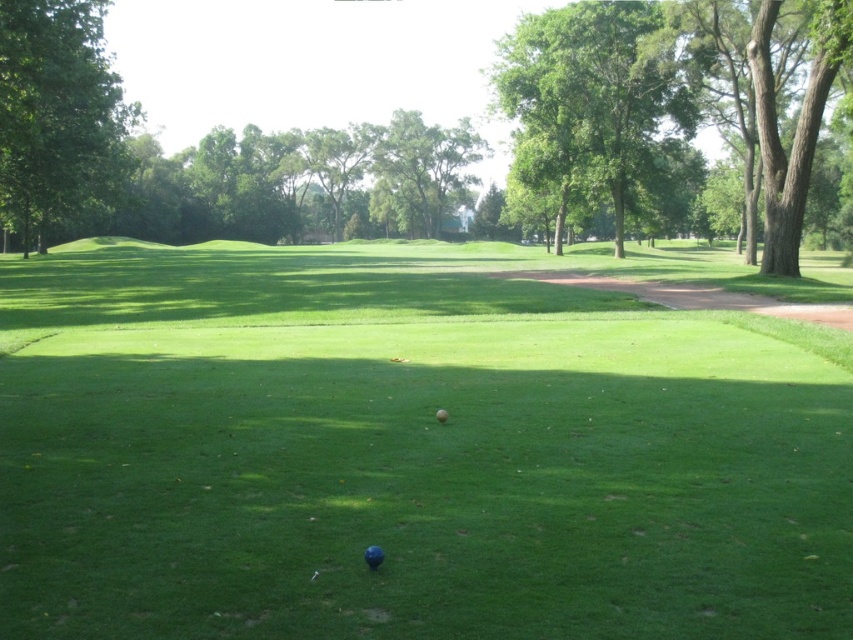
Does green grass at center appear under blue rubber golf ball at center?

Incorrect, green grass at center is not positioned below blue rubber golf ball at center.

You are a GUI agent. You are given a task and a screenshot of the screen. Output one action in this format:
    pyautogui.click(x=<x>, y=<y>)
    Task: Click on the green grass at center
    Image resolution: width=853 pixels, height=640 pixels.
    Given the screenshot: What is the action you would take?
    pyautogui.click(x=415, y=445)

Can you confirm if green leafy tree at upper center is positioned below blue rubber golf ball at center?

Actually, green leafy tree at upper center is above blue rubber golf ball at center.

Can you confirm if green leafy tree at upper center is positioned to the left of blue rubber golf ball at center?

Incorrect, green leafy tree at upper center is not on the left side of blue rubber golf ball at center.

Is point (639, 125) positioned before point (363, 556)?

No, (639, 125) is behind (363, 556).

What are the coordinates of `green leafy tree at upper center` in the screenshot? It's located at (585, 100).

Does blue rubber golf ball at center lie in front of blue matte golf ball at center?

Yes, it is in front of blue matte golf ball at center.

The width and height of the screenshot is (853, 640). Identify the location of blue rubber golf ball at center. pyautogui.click(x=373, y=556).

What do you see at coordinates (373, 556) in the screenshot? The image size is (853, 640). I see `blue rubber golf ball at center` at bounding box center [373, 556].

Where is `blue rubber golf ball at center`? The width and height of the screenshot is (853, 640). blue rubber golf ball at center is located at coordinates (373, 556).